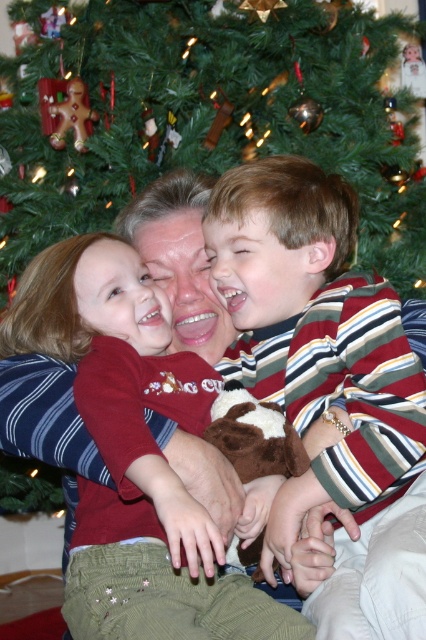
Question: Which is nearer to the striped cotton shirt at center?

Choices:
 (A) matte red shirt at center
 (B) matte gingerbread man at upper left

Answer: (A)

Question: Is striped cotton shirt at center below matte red shirt at center?

Choices:
 (A) no
 (B) yes

Answer: (A)

Question: Which point appears closest to the camera in this image?

Choices:
 (A) (106, 506)
 (B) (339, 544)
 (C) (80, 136)

Answer: (B)

Question: Which point is farther to the camera?

Choices:
 (A) striped cotton shirt at center
 (B) matte red shirt at center

Answer: (B)

Question: Does striped cotton shirt at center appear on the right side of matte gingerbread man at upper left?

Choices:
 (A) yes
 (B) no

Answer: (A)

Question: Does striped cotton shirt at center come in front of matte red shirt at center?

Choices:
 (A) no
 (B) yes

Answer: (B)